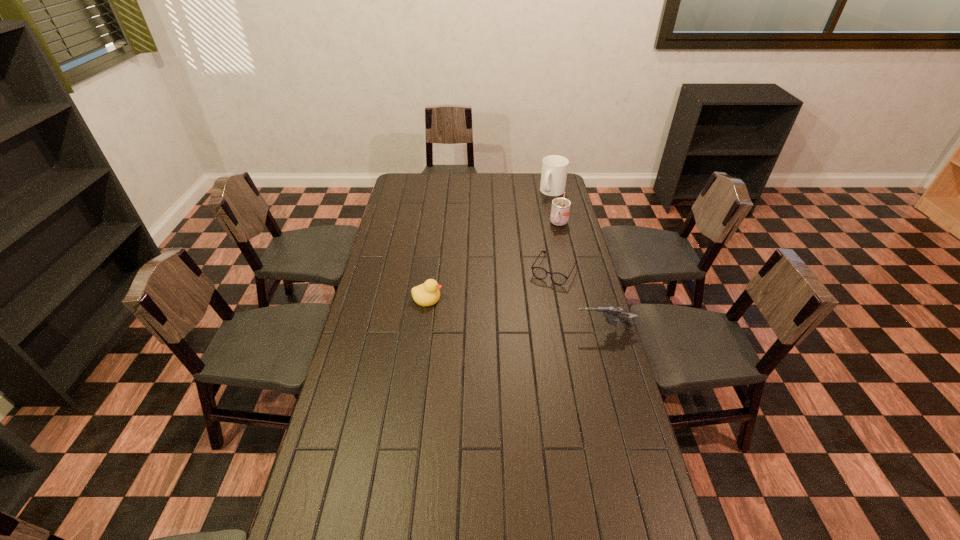
Locate an element on the screen. free region at the left edge of the desktop is located at coordinates (373, 465).

Where is `vacant space at the right edge of the desktop`? vacant space at the right edge of the desktop is located at coordinates (603, 332).

Find the location of a particular element. This screenshot has height=540, width=960. vacant area at the far left corner of the desktop is located at coordinates (420, 177).

In the image, there is a desktop. Where is `free space at the near left corner`? The height and width of the screenshot is (540, 960). free space at the near left corner is located at coordinates (320, 510).

The height and width of the screenshot is (540, 960). What are the coordinates of `blank space at the near right corner` in the screenshot? It's located at (645, 524).

In order to click on vacant space in between the third nearest object and the tallest object in this screenshot , I will do `click(554, 231)`.

Locate an element on the screen. Image resolution: width=960 pixels, height=540 pixels. free space between the third tallest object and the mug is located at coordinates (578, 260).

The image size is (960, 540). Find the location of `free space between the tallest object and the nearest object`. free space between the tallest object and the nearest object is located at coordinates (578, 260).

Where is `vacant point located between the fourth shortest object and the second shortest object`? This screenshot has width=960, height=540. vacant point located between the fourth shortest object and the second shortest object is located at coordinates (493, 261).

Find the location of `free space between the gun and the fourth farthest object`. free space between the gun and the fourth farthest object is located at coordinates (516, 313).